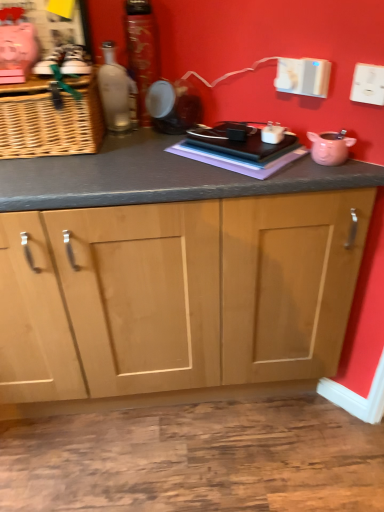
Question: Considering the relative positions of matte glass bottle at upper left, the 1th bottle from the left, and woven brown basket at left in the image provided, is matte glass bottle at upper left, the 1th bottle from the left, behind woven brown basket at left?

Choices:
 (A) yes
 (B) no

Answer: (A)

Question: Could you tell me if matte glass bottle at upper left, the 1th bottle from the left, is facing woven brown basket at left?

Choices:
 (A) no
 (B) yes

Answer: (A)

Question: Considering the relative sizes of matte glass bottle at upper left, the 1th bottle from the left, and woven brown basket at left in the image provided, is matte glass bottle at upper left, the 1th bottle from the left, shorter than woven brown basket at left?

Choices:
 (A) no
 (B) yes

Answer: (A)

Question: Is matte glass bottle at upper left, the 2th bottle viewed from the right, thinner than woven brown basket at left?

Choices:
 (A) no
 (B) yes

Answer: (B)

Question: Would you consider matte glass bottle at upper left, the 2th bottle viewed from the right, to be distant from woven brown basket at left?

Choices:
 (A) yes
 (B) no

Answer: (B)

Question: From their relative heights in the image, would you say woven brown basket at left is taller or shorter than pink matte piggy bank at right, the 1th appliance in the front-to-back sequence?

Choices:
 (A) short
 (B) tall

Answer: (B)

Question: Relative to pink matte piggy bank at right, the 1th appliance in the front-to-back sequence, is woven brown basket at left in front or behind?

Choices:
 (A) front
 (B) behind

Answer: (B)

Question: Is point (51, 114) closer or farther from the camera than point (316, 147)?

Choices:
 (A) farther
 (B) closer

Answer: (A)

Question: Visually, is woven brown basket at left positioned to the left or to the right of pink matte piggy bank at right, the second appliance positioned from the top?

Choices:
 (A) left
 (B) right

Answer: (A)

Question: Is woven brown basket at left to the left or to the right of shiny metallic can at center, the 1th bottle when ordered from right to left, in the image?

Choices:
 (A) left
 (B) right

Answer: (A)

Question: From the image's perspective, is woven brown basket at left above or below shiny metallic can at center, which appears as the 2th bottle when viewed from the left?

Choices:
 (A) below
 (B) above

Answer: (A)

Question: Looking at their shapes, would you say woven brown basket at left is wider or thinner than shiny metallic can at center, the 1th bottle when ordered from right to left?

Choices:
 (A) thin
 (B) wide

Answer: (B)

Question: From a real-world perspective, is woven brown basket at left positioned above or below shiny metallic can at center, the 1th bottle when ordered from right to left?

Choices:
 (A) above
 (B) below

Answer: (B)

Question: Looking at the image, does shiny metallic can at center, which appears as the 2th bottle when viewed from the left, seem bigger or smaller compared to matte glass bottle at upper left, the 2th bottle viewed from the right?

Choices:
 (A) big
 (B) small

Answer: (A)

Question: From a real-world perspective, is shiny metallic can at center, the 1th bottle when ordered from right to left, positioned above or below matte glass bottle at upper left, the 1th bottle from the left?

Choices:
 (A) above
 (B) below

Answer: (B)